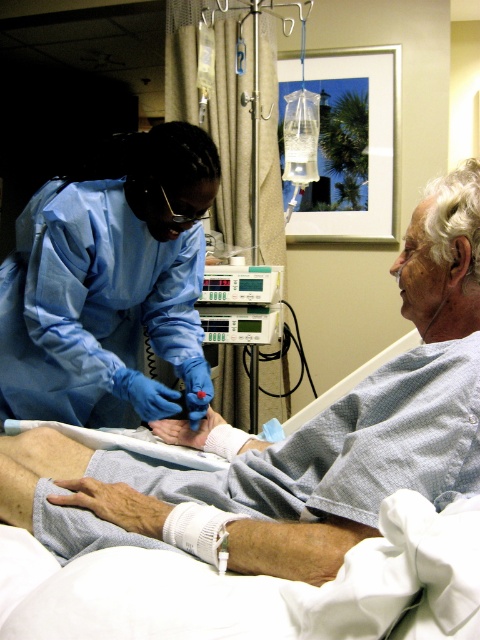
Question: Is the position of blue smooth gloves at upper left less distant than that of blue smooth gloves at left?

Choices:
 (A) no
 (B) yes

Answer: (B)

Question: Among these points, which one is nearest to the camera?

Choices:
 (A) (472, 241)
 (B) (22, 284)

Answer: (A)

Question: Can you confirm if blue smooth gloves at upper left is positioned to the left of blue smooth gloves at left?

Choices:
 (A) yes
 (B) no

Answer: (B)

Question: Which object is farther from the camera taking this photo?

Choices:
 (A) blue smooth gloves at upper left
 (B) blue smooth gloves at left

Answer: (B)

Question: Observing the image, what is the correct spatial positioning of blue smooth gloves at upper left in reference to blue smooth gloves at left?

Choices:
 (A) above
 (B) below

Answer: (B)

Question: Which of the following is the closest to the observer?

Choices:
 (A) blue smooth gloves at upper left
 (B) blue smooth gloves at left

Answer: (A)